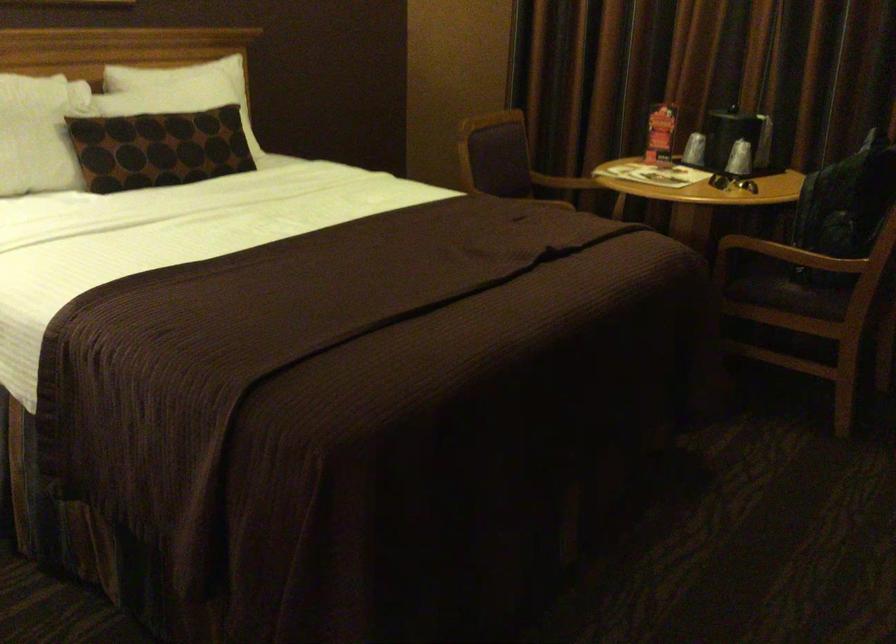
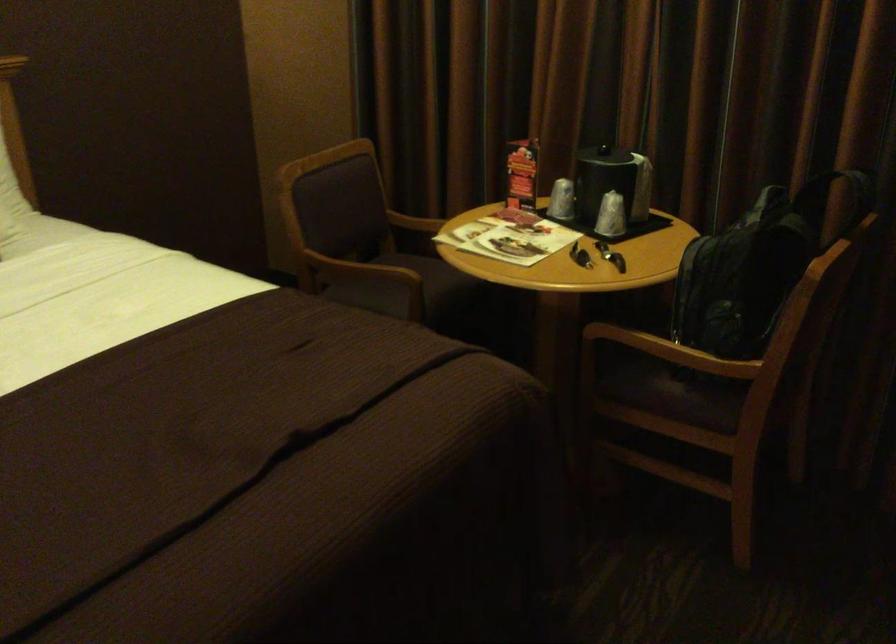
Where in the second image is the point corresponding to [556,178] from the first image?

(415, 222)